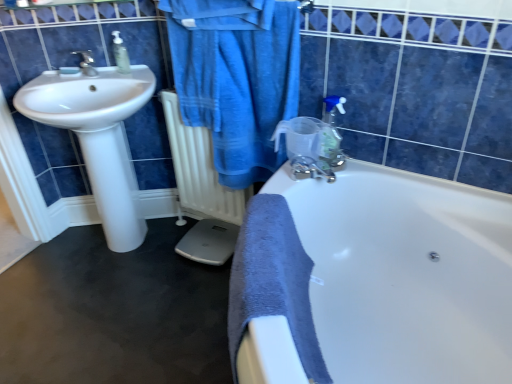
Question: Is white glossy sink at left shorter than clear plastic soap dispenser at upper left, which is counted as the first soap dispenser, starting from the top?

Choices:
 (A) no
 (B) yes

Answer: (A)

Question: Is white glossy sink at left in front of clear plastic soap dispenser at upper left, which is counted as the first soap dispenser, starting from the top?

Choices:
 (A) yes
 (B) no

Answer: (A)

Question: Is there a large distance between white glossy sink at left and clear plastic soap dispenser at upper left, which is counted as the first soap dispenser, starting from the top?

Choices:
 (A) no
 (B) yes

Answer: (A)

Question: Is white glossy sink at left facing away from clear plastic soap dispenser at upper left, which is counted as the first soap dispenser, starting from the top?

Choices:
 (A) yes
 (B) no

Answer: (B)

Question: From a real-world perspective, is white glossy sink at left beneath clear plastic soap dispenser at upper left, positioned as the first soap dispenser in left-to-right order?

Choices:
 (A) yes
 (B) no

Answer: (A)

Question: From the image's perspective, does white glossy sink at left appear lower than clear plastic soap dispenser at upper left, which is counted as the first soap dispenser, starting from the top?

Choices:
 (A) yes
 (B) no

Answer: (A)

Question: From a real-world perspective, is clear plastic soap dispenser at upper left, acting as the 2th soap dispenser starting from the bottom, over white matte radiator at center?

Choices:
 (A) yes
 (B) no

Answer: (A)

Question: Can you confirm if clear plastic soap dispenser at upper left, the second soap dispenser from the right, is shorter than white matte radiator at center?

Choices:
 (A) yes
 (B) no

Answer: (A)

Question: Is the position of clear plastic soap dispenser at upper left, which is counted as the first soap dispenser, starting from the top, less distant than that of white matte radiator at center?

Choices:
 (A) no
 (B) yes

Answer: (A)

Question: From a real-world perspective, is clear plastic soap dispenser at upper left, the 1th soap dispenser when ordered from back to front, beneath white matte radiator at center?

Choices:
 (A) no
 (B) yes

Answer: (A)

Question: Is clear plastic soap dispenser at upper left, the 1th soap dispenser when ordered from back to front, oriented away from white matte radiator at center?

Choices:
 (A) yes
 (B) no

Answer: (B)

Question: Is clear plastic soap dispenser at upper left, which is counted as the first soap dispenser, starting from the top, further to camera compared to white matte radiator at center?

Choices:
 (A) yes
 (B) no

Answer: (A)

Question: Does blue cotton bathrobe at upper center come in front of translucent plastic soap dispenser at upper right, which is the 2th soap dispenser from left to right?

Choices:
 (A) no
 (B) yes

Answer: (B)